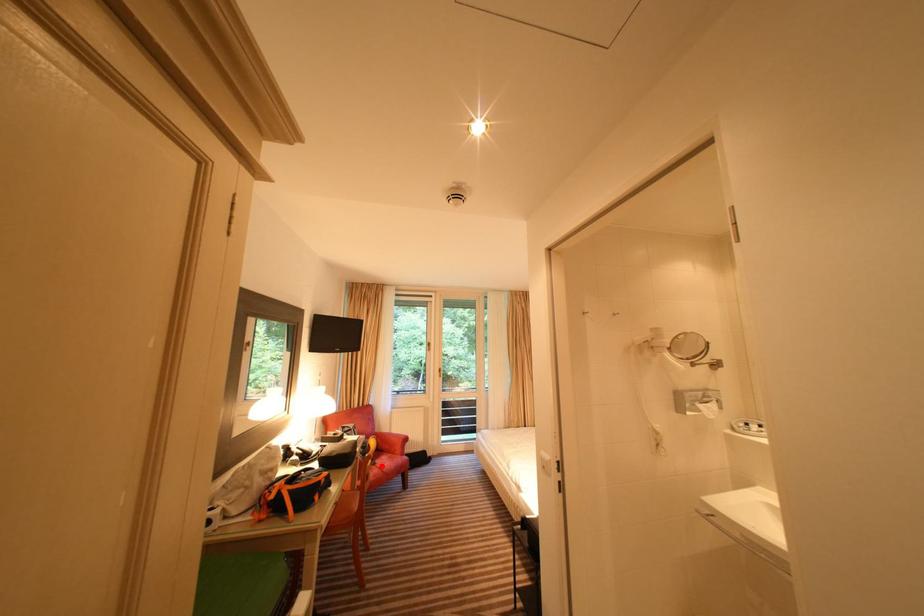
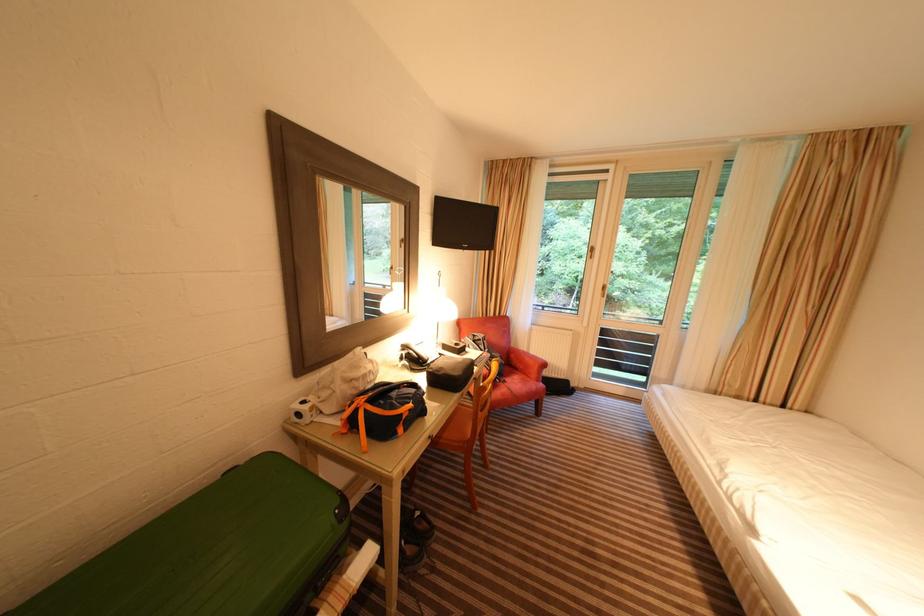
Where in the second image is the point corresponding to the highlighted location from the first image?

(512, 384)